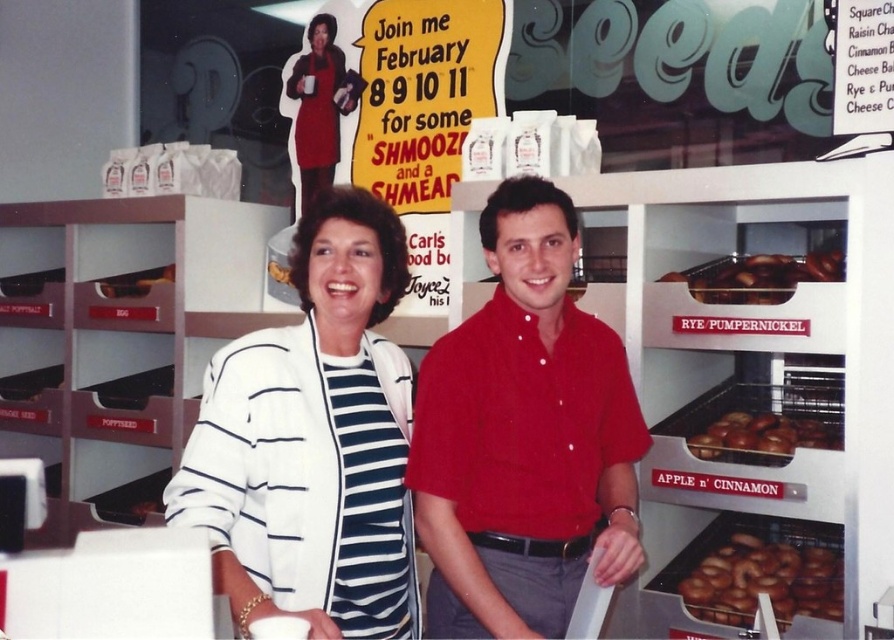
Which is more to the right, golden brown bagel at right or brown matte bagels at center right?

golden brown bagel at right

Consider the image. Which of these two, golden brown bagel at right or brown matte bagels at center right, stands shorter?

With less height is golden brown bagel at right.

Which is behind, point (777, 563) or point (766, 292)?

The point (777, 563) is more distant.

Image resolution: width=894 pixels, height=640 pixels. In order to click on golden brown bagel at right in this screenshot , I will do `click(763, 580)`.

Which of these two, brown matte bagels at center right or brown matte donuts at center right, stands taller?

With more height is brown matte bagels at center right.

Identify the location of brown matte bagels at center right. (757, 276).

Is point (800, 282) behind point (768, 412)?

No, it is not.

Identify the location of brown matte bagels at center right. (757, 276).

Is white striped blazer at center bigger than brown matte bagels at center right?

Yes, white striped blazer at center is bigger than brown matte bagels at center right.

Who is higher up, white striped blazer at center or brown matte bagels at center right?

brown matte bagels at center right is above.

The image size is (894, 640). I want to click on white striped blazer at center, so click(x=313, y=442).